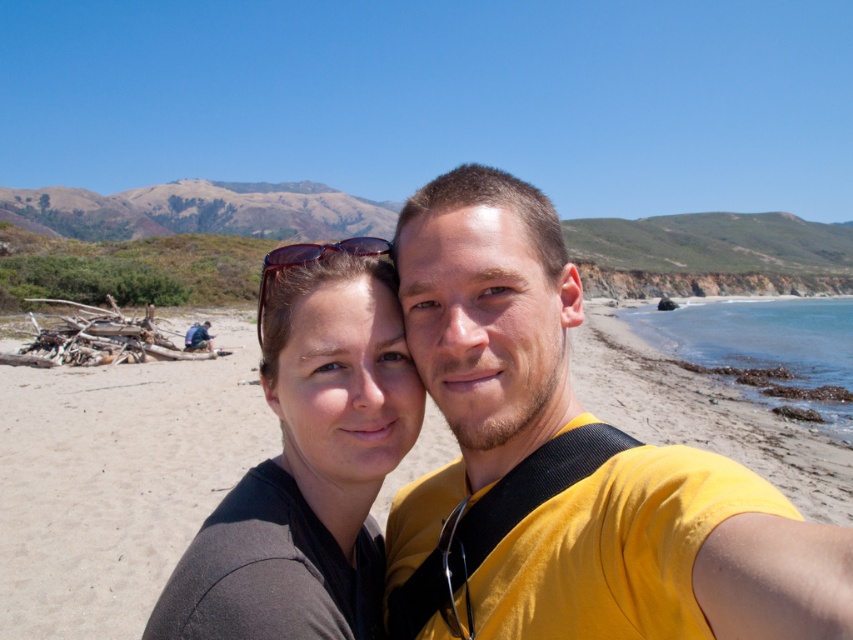
Question: Among these points, which one is farthest from the camera?

Choices:
 (A) (515, 401)
 (B) (41, 497)
 (C) (323, 433)

Answer: (B)

Question: Which point appears closest to the camera in this image?

Choices:
 (A) (412, 376)
 (B) (372, 248)
 (C) (210, 504)
 (D) (454, 573)

Answer: (D)

Question: Is the position of sandy beach at center less distant than that of matte black sunglasses at upper center?

Choices:
 (A) yes
 (B) no

Answer: (B)

Question: Based on their relative distances, which object is farther from the matte black sunglasses at center?

Choices:
 (A) matte black sunglasses at upper center
 (B) yellow matte shirt at center

Answer: (A)

Question: Can you confirm if sandy beach at center is smaller than matte black sunglasses at center?

Choices:
 (A) no
 (B) yes

Answer: (A)

Question: Is yellow matte shirt at center smaller than matte black sunglasses at center?

Choices:
 (A) no
 (B) yes

Answer: (A)